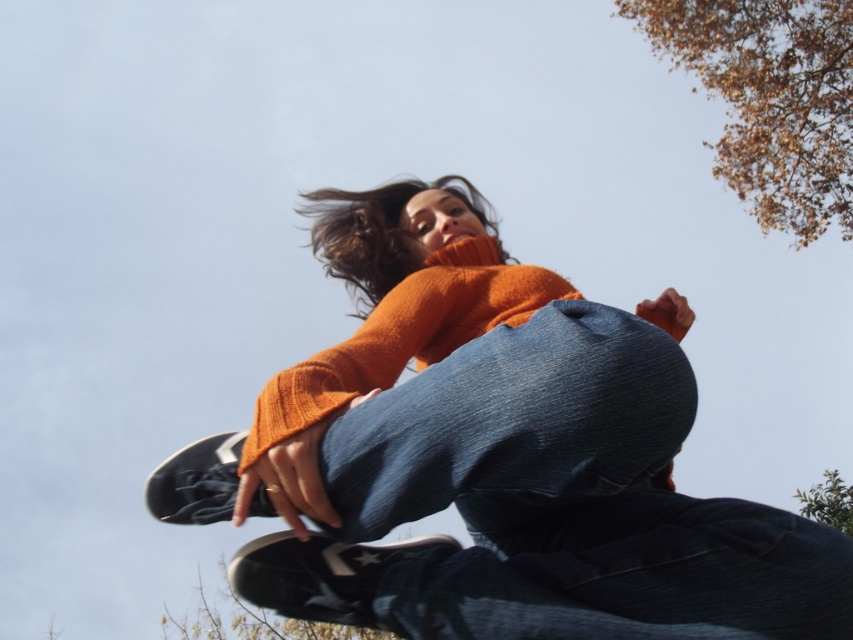
Based on the scene description, where is the denim at center in relation to the brown textured leaves at lower left?

The denim at center is to the right of the brown textured leaves at lower left.

You are a photographer trying to capture the person mid jump. You want to ensure that the brown leafy branches at upper right do not block the person in the photo. Based on their positions, is the person above or below the branches?

The person is below the brown leafy branches at upper right because the branches are located at the upper right of the image.

You are observing a person mid jump in a skate park. You see two points marked in the image. The first point is at coordinates point [596,413] and the second point is at point [228,620]. Which point is closer to you, the observer?

Point [596,413] is in front of point [228,620], so it is closer to you.